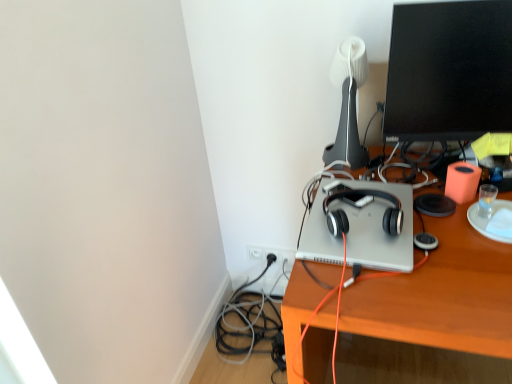
Locate an element on the screen. The width and height of the screenshot is (512, 384). silver metallic laptop at center is located at coordinates (360, 225).

The image size is (512, 384). What do you see at coordinates (441, 295) in the screenshot? I see `wooden desk at center` at bounding box center [441, 295].

Image resolution: width=512 pixels, height=384 pixels. I want to click on black glossy monitor at upper right, so click(449, 71).

Would you say black glossy monitor at upper right is inside or outside wooden desk at center?

black glossy monitor at upper right is not enclosed by wooden desk at center.

Considering the sizes of objects black glossy monitor at upper right and wooden desk at center in the image provided, who is shorter, black glossy monitor at upper right or wooden desk at center?

With less height is black glossy monitor at upper right.

Which is more to the right, black glossy monitor at upper right or wooden desk at center?

wooden desk at center is more to the right.

Is silver metallic laptop at center far from white matte table lamp at upper center?

No, silver metallic laptop at center is not far away from white matte table lamp at upper center.

Would you say white matte table lamp at upper center is part of silver metallic laptop at center's contents?

Actually, white matte table lamp at upper center is outside silver metallic laptop at center.

Does point (322, 229) appear closer or farther from the camera than point (366, 75)?

Clearly, point (322, 229) is closer to the camera than point (366, 75).

Is silver metallic laptop at center positioned with its back to white matte table lamp at upper center?

Yes, white matte table lamp at upper center is at the back of silver metallic laptop at center.

In terms of size, does black glossy monitor at upper right appear bigger or smaller than satin black headphones at center?

Considering their sizes, black glossy monitor at upper right takes up more space than satin black headphones at center.

From the image's perspective, relative to satin black headphones at center, is black glossy monitor at upper right above or below?

From the image's perspective, black glossy monitor at upper right appears above satin black headphones at center.

Would you say black glossy monitor at upper right is outside satin black headphones at center?

Yes.

Which is correct: white matte table lamp at upper center is inside wooden desk at center, or outside of it?

white matte table lamp at upper center is not inside wooden desk at center, it's outside.

Are white matte table lamp at upper center and wooden desk at center far apart?

No, white matte table lamp at upper center is in close proximity to wooden desk at center.

Is point (343, 127) closer or farther from the camera than point (503, 327)?

Point (343, 127) is positioned farther from the camera compared to point (503, 327).

From a real-world perspective, who is located lower, white matte table lamp at upper center or wooden desk at center?

wooden desk at center, from a real-world perspective.

Locate an element on the screen. Image resolution: width=512 pixels, height=384 pixels. table lamp positioned vertically above the satin black headphones at center (from a real-world perspective) is located at coordinates (348, 103).

Is the surface of white matte table lamp at upper center in direct contact with satin black headphones at center?

No, white matte table lamp at upper center is not in contact with satin black headphones at center.

From the image's perspective, which is below, white matte table lamp at upper center or satin black headphones at center?

satin black headphones at center.

Choose the correct answer: Is white matte table lamp at upper center inside satin black headphones at center or outside it?

white matte table lamp at upper center is outside satin black headphones at center.

How distant is wooden desk at center from white matte table lamp at upper center?

wooden desk at center is 33.23 centimeters away from white matte table lamp at upper center.

From a real-world perspective, relative to white matte table lamp at upper center, is wooden desk at center vertically above or below?

Clearly, from a real-world perspective, wooden desk at center is below white matte table lamp at upper center.

Can you confirm if wooden desk at center is thinner than white matte table lamp at upper center?

No.

Considering the relative positions of white matte table lamp at upper center and silver metallic laptop at center in the image provided, is white matte table lamp at upper center to the right of silver metallic laptop at center from the viewer's perspective?

Indeed, white matte table lamp at upper center is positioned on the right side of silver metallic laptop at center.

Can you confirm if white matte table lamp at upper center is wider than silver metallic laptop at center?

No, white matte table lamp at upper center is not wider than silver metallic laptop at center.

Is white matte table lamp at upper center not close to silver metallic laptop at center?

They are positioned close to each other.

From the picture: Is white matte table lamp at upper center taller or shorter than silver metallic laptop at center?

Considering their sizes, white matte table lamp at upper center has more height than silver metallic laptop at center.

Image resolution: width=512 pixels, height=384 pixels. I want to click on desk directly beneath the black glossy monitor at upper right (from a real-world perspective), so click(x=441, y=295).

Image resolution: width=512 pixels, height=384 pixels. What are the coordinates of `table lamp above the silver metallic laptop at center (from a real-world perspective)` in the screenshot? It's located at (348, 103).

Looking at the image, which one is located closer to satin black headphones at center, black glossy monitor at upper right or wooden desk at center?

Among the two, wooden desk at center is located nearer to satin black headphones at center.

Which object lies further to the anchor point satin black headphones at center, black glossy monitor at upper right or white matte table lamp at upper center?

black glossy monitor at upper right is further to satin black headphones at center.

Based on their spatial positions, is wooden desk at center or black glossy monitor at upper right closer to white matte table lamp at upper center?

black glossy monitor at upper right is positioned closer to the anchor white matte table lamp at upper center.

Which object lies further to the anchor point white matte table lamp at upper center, silver metallic laptop at center or satin black headphones at center?

satin black headphones at center.

Looking at the image, which one is located further to wooden desk at center, white matte table lamp at upper center or silver metallic laptop at center?

white matte table lamp at upper center is further to wooden desk at center.

From the image, which object appears to be farther from silver metallic laptop at center, satin black headphones at center or black glossy monitor at upper right?

Among the two, black glossy monitor at upper right is located further to silver metallic laptop at center.

Based on their spatial positions, is satin black headphones at center or black glossy monitor at upper right closer to wooden desk at center?

The object closer to wooden desk at center is satin black headphones at center.

Looking at the image, which one is located further to silver metallic laptop at center, white matte table lamp at upper center or satin black headphones at center?

white matte table lamp at upper center is positioned further to the anchor silver metallic laptop at center.

Identify the location of headphones between white matte table lamp at upper center and silver metallic laptop at center in the up-down direction. (361, 207).

You are a GUI agent. You are given a task and a screenshot of the screen. Output one action in this format:
    pyautogui.click(x=<x>, y=<y>)
    Task: Click on the table lamp between black glossy monitor at upper right and satin black headphones at center in the vertical direction
    
    Given the screenshot: What is the action you would take?
    pyautogui.click(x=348, y=103)

Find the location of a particular element. The image size is (512, 384). table lamp between black glossy monitor at upper right and silver metallic laptop at center vertically is located at coordinates (348, 103).

The height and width of the screenshot is (384, 512). Find the location of `computer between black glossy monitor at upper right and wooden desk at center in the up-down direction`. computer between black glossy monitor at upper right and wooden desk at center in the up-down direction is located at coordinates (360, 225).